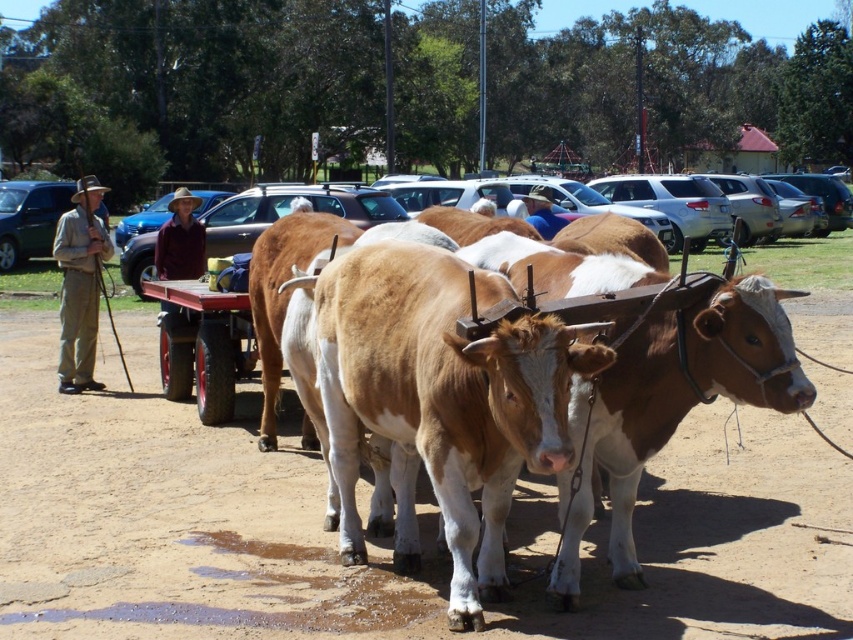
You are standing at the center of the image and see a brown cotton shirt at center. Can you tell me what is located at the point with coordinates (180,241)?

At point (180,241) lies the brown cotton shirt at center.

You are a photographer standing in the middle of the scene. You want to take a picture of the blue metallic car at center without the khaki fabric pants at left blocking the view. Which direction should you move to ensure the car is visible?

The khaki fabric pants at left is in front of the blue metallic car at center. To avoid blocking the view, move to the right side so that the car is no longer obscured by the pants.

You are standing at the point labeled point (x=115, y=225) and want to move towards the point labeled point (x=78, y=186). Given that the distance between them is 0.05 meters, can you safely walk straight towards it without any obstacles?

The distance between the two points is only 0.05 meters, so you can easily walk straight towards it without any obstacles.